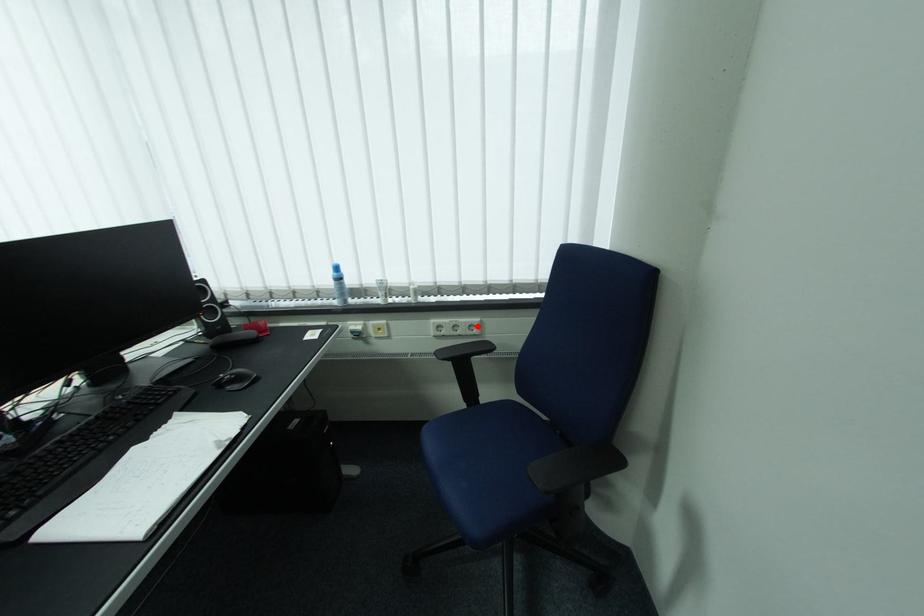
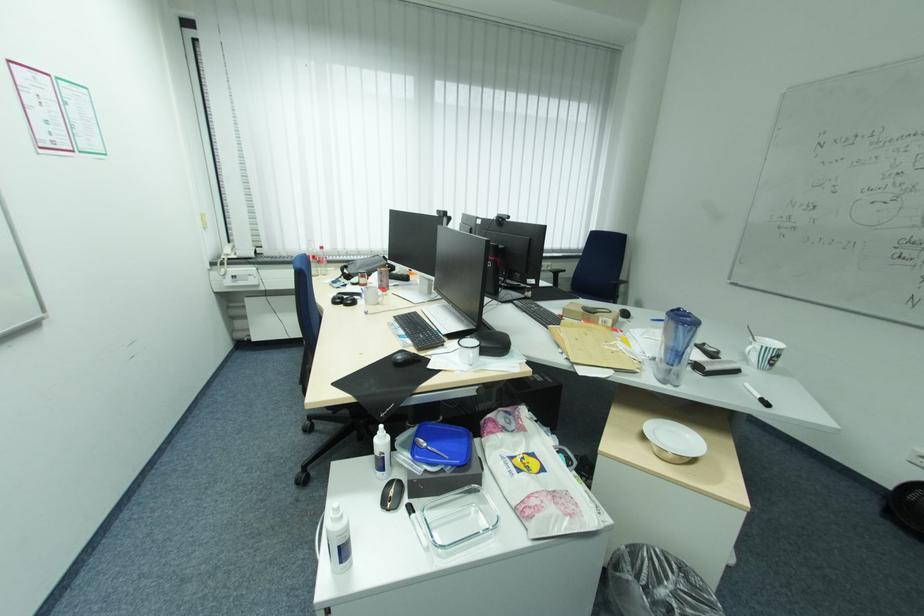
Question: I am providing you with two images of the same scene from different viewpoints. In image1, a red point is highlighted. Considering the same 3D point in image2, which of the following is correct?

Choices:
 (A) It is closer
 (B) It is farther

Answer: (B)